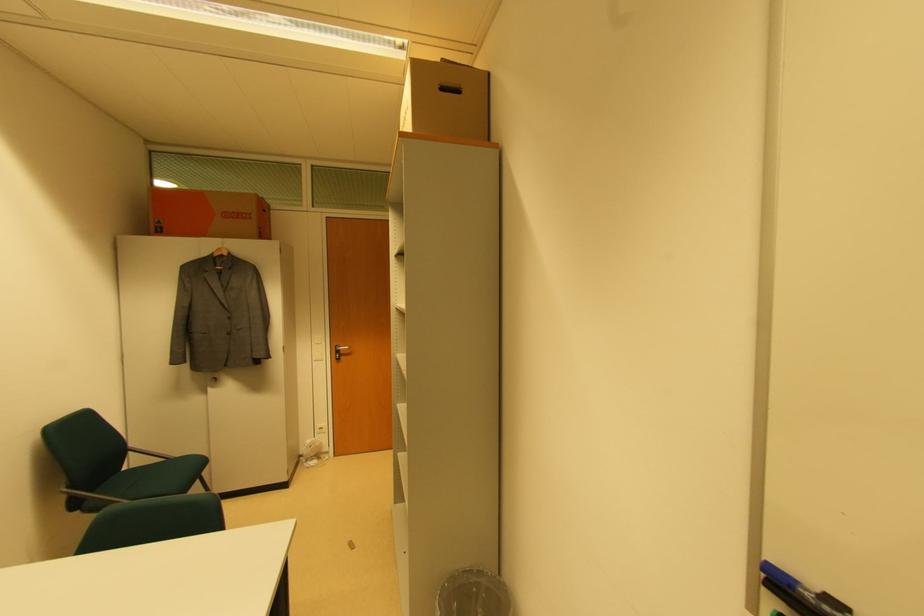
Image resolution: width=924 pixels, height=616 pixels. Find the location of `green chair armrest`. green chair armrest is located at coordinates (91, 495).